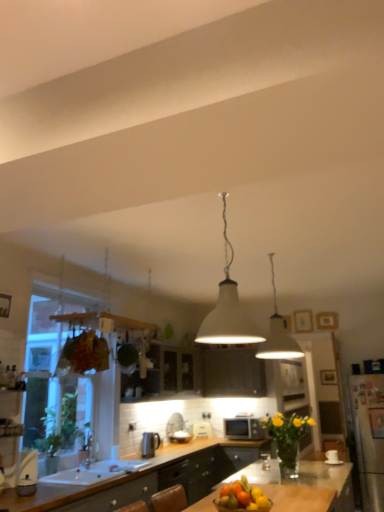
Question: Is the depth of matte black microwave at center less than that of white glossy cabinet at center?

Choices:
 (A) no
 (B) yes

Answer: (A)

Question: Does matte black microwave at center have a greater width compared to white glossy cabinet at center?

Choices:
 (A) yes
 (B) no

Answer: (A)

Question: Does matte black microwave at center appear on the right side of white glossy cabinet at center?

Choices:
 (A) yes
 (B) no

Answer: (A)

Question: Is matte black microwave at center not close to white glossy cabinet at center?

Choices:
 (A) no
 (B) yes

Answer: (A)

Question: Does matte black microwave at center have a lesser width compared to white glossy cabinet at center?

Choices:
 (A) yes
 (B) no

Answer: (B)

Question: From the image's perspective, is matte black microwave at center on white glossy cabinet at center?

Choices:
 (A) yes
 (B) no

Answer: (B)

Question: Considering the relative sizes of transparent glass window at left and white glossy toaster at center, the 1th appliance viewed from the left, in the image provided, is transparent glass window at left wider than white glossy toaster at center, the 1th appliance viewed from the left,?

Choices:
 (A) no
 (B) yes

Answer: (B)

Question: From the image's perspective, would you say transparent glass window at left is positioned over white glossy toaster at center, which appears as the 2th appliance when viewed from the back?

Choices:
 (A) no
 (B) yes

Answer: (B)

Question: Does transparent glass window at left touch white glossy toaster at center, placed as the 2th appliance when sorted from right to left?

Choices:
 (A) yes
 (B) no

Answer: (B)

Question: From a real-world perspective, does transparent glass window at left sit lower than white glossy toaster at center, placed as the 2th appliance when sorted from right to left?

Choices:
 (A) no
 (B) yes

Answer: (A)

Question: Can you confirm if transparent glass window at left is shorter than white glossy toaster at center, which is the 1th appliance in front-to-back order?

Choices:
 (A) no
 (B) yes

Answer: (A)

Question: Does transparent glass window at left have a larger size compared to white glossy toaster at center, which is the 1th appliance in front-to-back order?

Choices:
 (A) no
 (B) yes

Answer: (B)

Question: Considering the relative sizes of white matte lampshade at center, the second lamp from the front, and white glossy toaster at center, the 1th appliance viewed from the left, in the image provided, is white matte lampshade at center, the second lamp from the front, smaller than white glossy toaster at center, the 1th appliance viewed from the left,?

Choices:
 (A) no
 (B) yes

Answer: (A)